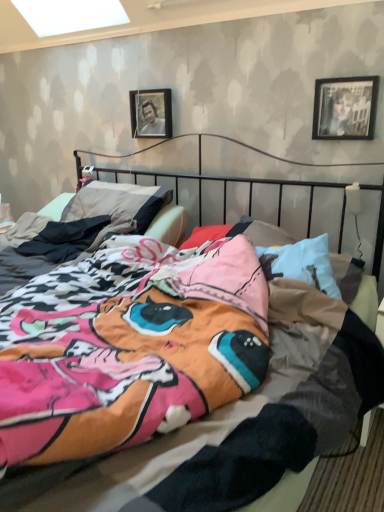
Question: Is black glossy photo frame at upper right, acting as the 2th picture frame starting from the back, positioned beyond the bounds of wooden frame at upper center, positioned as the 1th picture frame in back-to-front order?

Choices:
 (A) yes
 (B) no

Answer: (A)

Question: From the image's perspective, is black glossy photo frame at upper right, the 2th picture frame from the left, above wooden frame at upper center, marked as the 2th picture frame in a front-to-back arrangement?

Choices:
 (A) yes
 (B) no

Answer: (B)

Question: Is black glossy photo frame at upper right, the first picture frame when ordered from front to back, far from wooden frame at upper center, marked as the 2th picture frame in a right-to-left arrangement?

Choices:
 (A) yes
 (B) no

Answer: (B)

Question: Is black glossy photo frame at upper right, placed as the 1th picture frame when sorted from right to left, at the right side of wooden frame at upper center, acting as the 1th picture frame starting from the left?

Choices:
 (A) no
 (B) yes

Answer: (B)

Question: Is black glossy photo frame at upper right, the first picture frame when ordered from front to back, positioned behind wooden frame at upper center, positioned as the 1th picture frame in back-to-front order?

Choices:
 (A) no
 (B) yes

Answer: (A)

Question: Does black glossy photo frame at upper right, acting as the 2th picture frame starting from the back, turn towards wooden frame at upper center, marked as the 2th picture frame in a front-to-back arrangement?

Choices:
 (A) no
 (B) yes

Answer: (A)

Question: Can black glossy photo frame at upper right, acting as the 2th picture frame starting from the back, be found inside wooden frame at upper center, marked as the 2th picture frame in a right-to-left arrangement?

Choices:
 (A) no
 (B) yes

Answer: (A)

Question: Can you confirm if wooden frame at upper center, positioned as the 1th picture frame in back-to-front order, is shorter than black glossy photo frame at upper right, the 2th picture frame from the left?

Choices:
 (A) no
 (B) yes

Answer: (B)

Question: Is wooden frame at upper center, marked as the 2th picture frame in a front-to-back arrangement, facing away from black glossy photo frame at upper right, the 2th picture frame from the left?

Choices:
 (A) yes
 (B) no

Answer: (B)

Question: Can you confirm if wooden frame at upper center, marked as the 2th picture frame in a right-to-left arrangement, is smaller than black glossy photo frame at upper right, the 2th picture frame from the left?

Choices:
 (A) no
 (B) yes

Answer: (A)

Question: Can you confirm if wooden frame at upper center, marked as the 2th picture frame in a front-to-back arrangement, is positioned to the right of black glossy photo frame at upper right, the 2th picture frame from the left?

Choices:
 (A) no
 (B) yes

Answer: (A)

Question: From a real-world perspective, is wooden frame at upper center, marked as the 2th picture frame in a front-to-back arrangement, on black glossy photo frame at upper right, the first picture frame when ordered from front to back?

Choices:
 (A) no
 (B) yes

Answer: (A)

Question: From the image's perspective, is wooden frame at upper center, positioned as the 1th picture frame in back-to-front order, located above or below black glossy photo frame at upper right, the 2th picture frame from the left?

Choices:
 (A) above
 (B) below

Answer: (A)